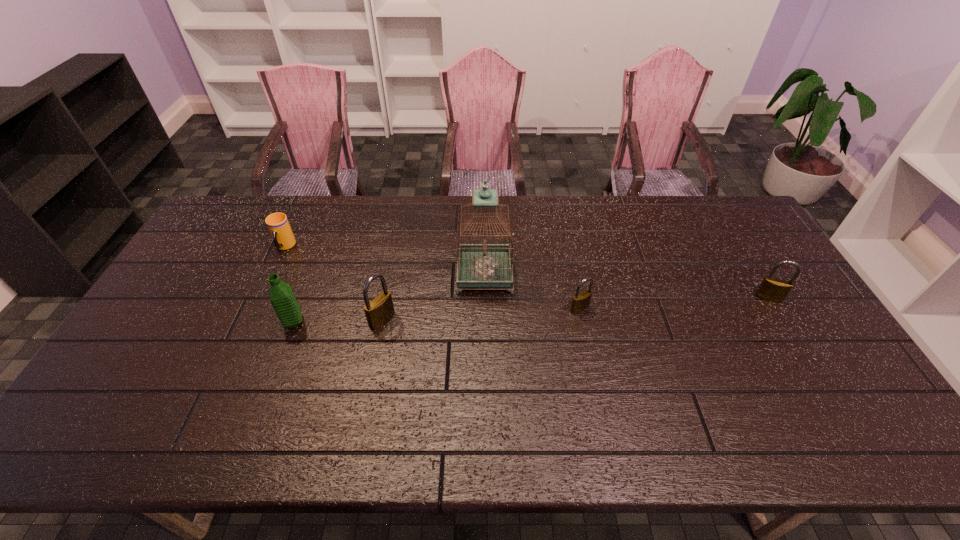
In the image, there is a desktop. Where is `vacant space at the left edge`? vacant space at the left edge is located at coordinates (175, 322).

Identify the location of vacant region at the right edge of the desktop. (787, 373).

In the image, there is a desktop. Identify the location of vacant space at the far left corner. (233, 218).

Find the location of `vacant area at the near left corner of the desktop`. vacant area at the near left corner of the desktop is located at coordinates (143, 377).

You are a GUI agent. You are given a task and a screenshot of the screen. Output one action in this format:
    pyautogui.click(x=<x>, y=<y>)
    Task: Click on the vacant area that lies between the tallest object and the second tallest padlock
    Image resolution: width=960 pixels, height=540 pixels.
    Given the screenshot: What is the action you would take?
    coord(626,286)

You are a GUI agent. You are given a task and a screenshot of the screen. Output one action in this format:
    pyautogui.click(x=<x>, y=<y>)
    Task: Click on the free area in between the water bottle and the leftmost padlock
    The image size is (960, 540).
    Given the screenshot: What is the action you would take?
    pyautogui.click(x=338, y=321)

Where is `free space between the tallest object and the rightmost object`? This screenshot has width=960, height=540. free space between the tallest object and the rightmost object is located at coordinates (626, 286).

Identify the location of vacant space that is in between the shortest padlock and the tallest object. (532, 291).

Find the location of `vacant area that lies between the leftmost object and the leftmost padlock`. vacant area that lies between the leftmost object and the leftmost padlock is located at coordinates (333, 284).

At what (x,y) coordinates should I click in order to perform the action: click on vacant area between the shortest padlock and the tallest object. Please return your answer as a coordinate pair (x, y). The height and width of the screenshot is (540, 960). Looking at the image, I should click on (532, 291).